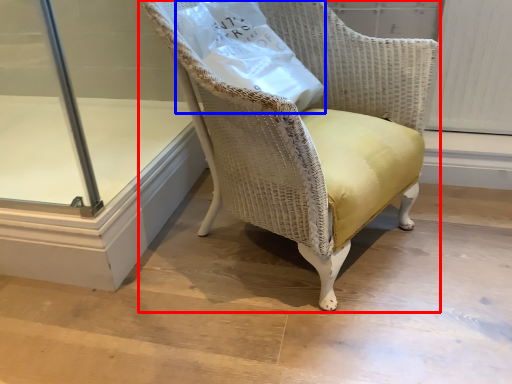
Question: Which point is further to the camera, chair (highlighted by a red box) or paper bag (highlighted by a blue box)?

Choices:
 (A) chair
 (B) paper bag

Answer: (B)